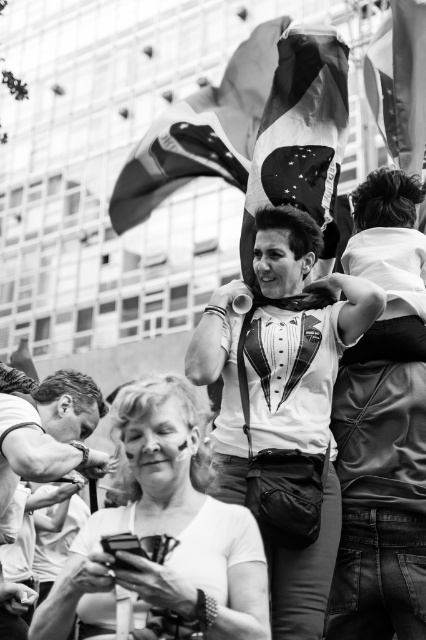
You are a photographer who wants to capture the printed fabric flag at center in your shot. Based on the scene description, where should you position your camera to ensure the flag is centered in the frame?

The printed fabric flag at center is already positioned at the center of the image at coordinates point (299, 136), so positioning the camera to aim directly at this point will ensure the flag is centered in the frame.

Looking at this image, you are a photographer reviewing this black and white photo. You notice the american flag at upper center and the smooth leather watch at lower left. Which object appears larger in the image?

The smooth leather watch at lower left appears larger because the american flag at upper center is smaller than smooth leather watch at lower left.